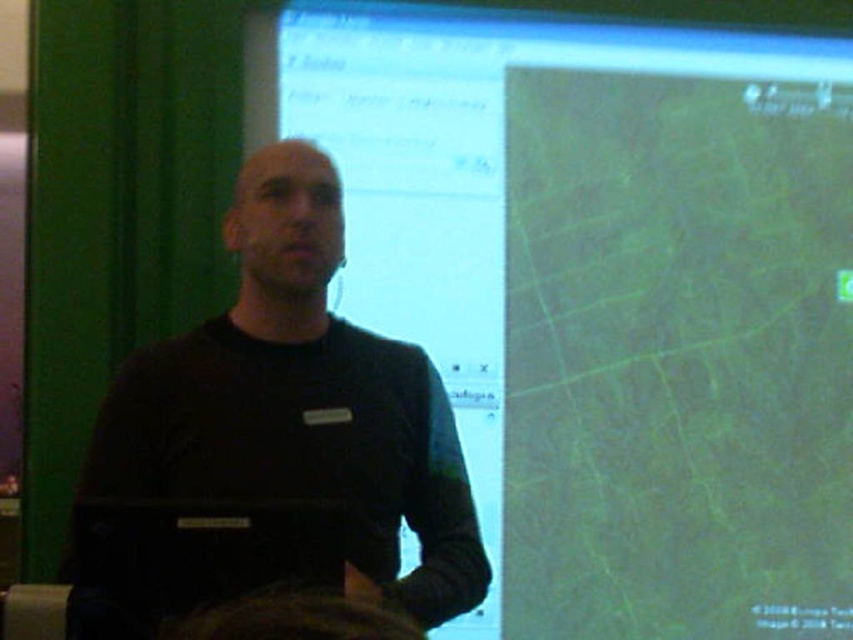
Question: Can you confirm if green matte map at center is positioned below black matte laptop at center?

Choices:
 (A) yes
 (B) no

Answer: (B)

Question: Which object appears closest to the camera in this image?

Choices:
 (A) black matte laptop at center
 (B) green matte map at center

Answer: (A)

Question: Can you confirm if green matte map at center is thinner than black matte laptop at center?

Choices:
 (A) no
 (B) yes

Answer: (A)

Question: Does green matte map at center have a greater width compared to black matte laptop at center?

Choices:
 (A) yes
 (B) no

Answer: (A)

Question: Which point is farther to the camera?

Choices:
 (A) (764, 540)
 (B) (378, 349)

Answer: (A)